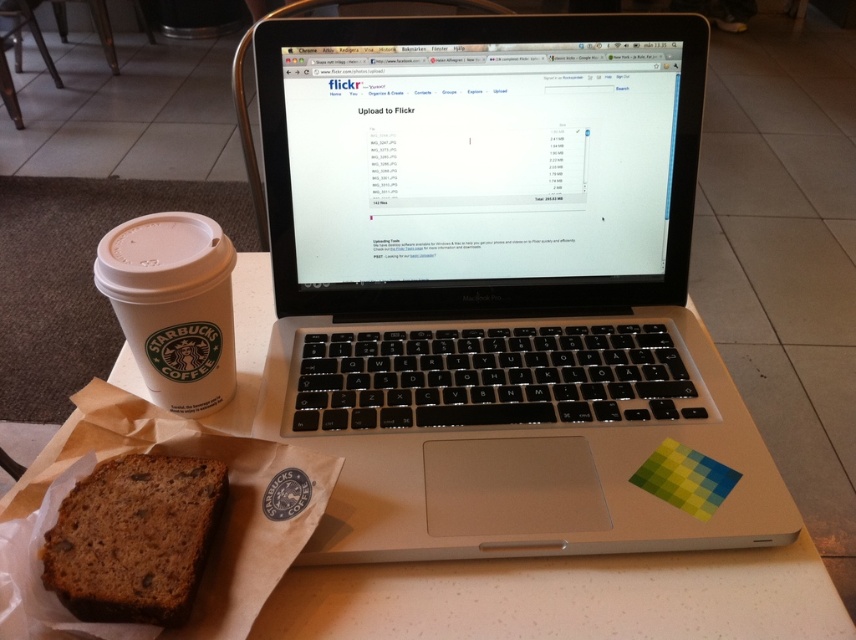
Which of these two, brown crumbly bread at lower left or white matte cup at left, stands taller?

With more height is white matte cup at left.

Can you confirm if brown crumbly bread at lower left is shorter than white matte cup at left?

Correct, brown crumbly bread at lower left is not as tall as white matte cup at left.

The image size is (856, 640). Find the location of `brown crumbly bread at lower left`. brown crumbly bread at lower left is located at coordinates (135, 538).

Which is in front, point (521, 612) or point (169, 320)?

Point (521, 612) is in front.

Image resolution: width=856 pixels, height=640 pixels. What are the coordinates of `white paper napkin at lower left` in the screenshot? It's located at (568, 598).

Find the location of a particular element. white paper napkin at lower left is located at coordinates (568, 598).

In the scene shown: Which is below, silver/black plastic laptop at center or white matte cup at left?

white matte cup at left is below.

Is silver/black plastic laptop at center thinner than white matte cup at left?

Incorrect, silver/black plastic laptop at center's width is not less than white matte cup at left's.

Measure the distance between silver/black plastic laptop at center and camera.

48.42 centimeters

At what (x,y) coordinates should I click in order to perform the action: click on silver/black plastic laptop at center. Please return your answer as a coordinate pair (x, y). Looking at the image, I should click on (497, 284).